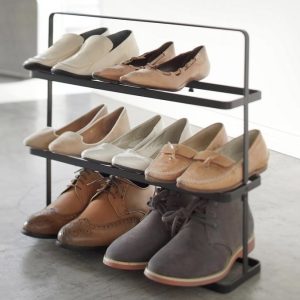
Identify the location of shoes on the bottom shelf. Image resolution: width=300 pixels, height=300 pixels. (64, 204), (99, 215), (144, 230), (198, 244).